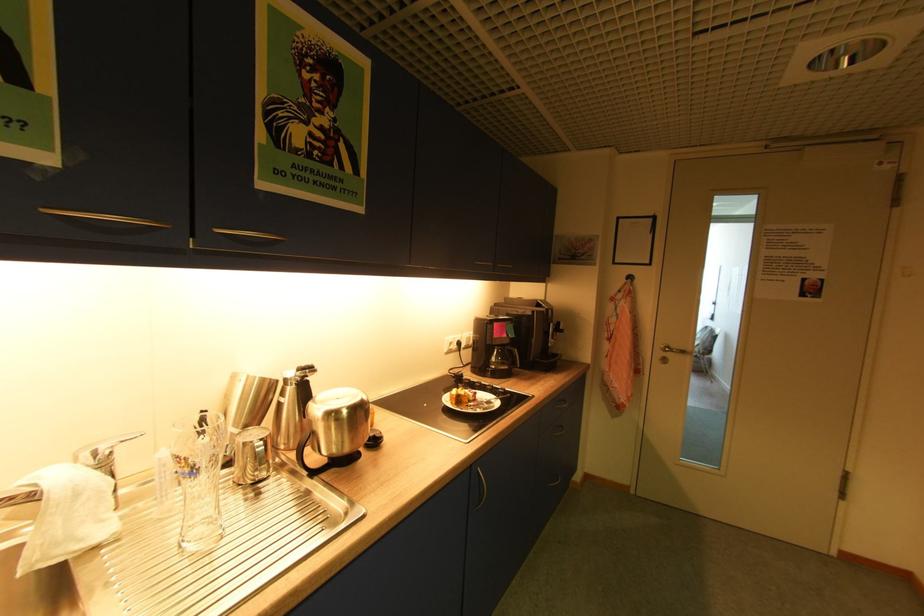
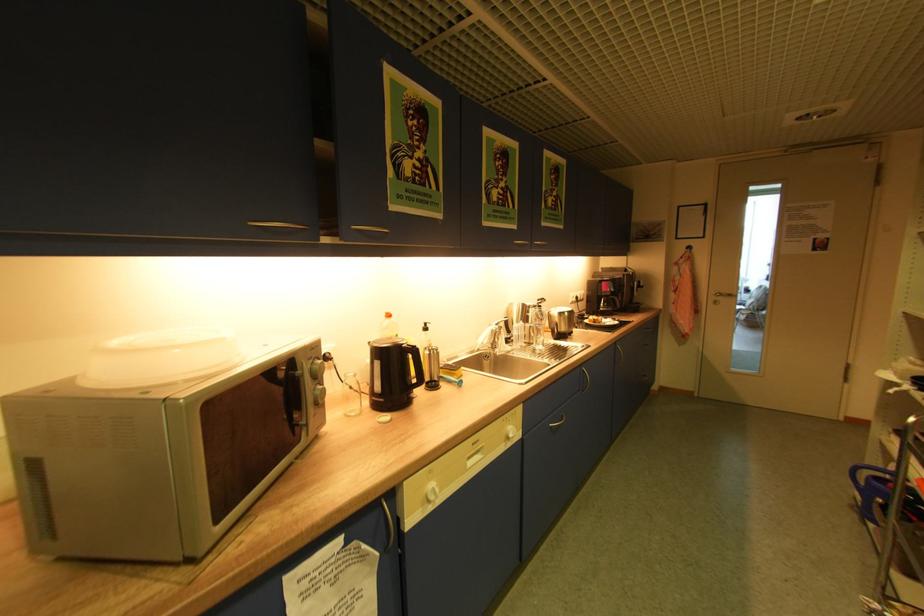
Which direction would the cameraman need to move to produce the second image?

The movement direction of the cameraman is left, backward.